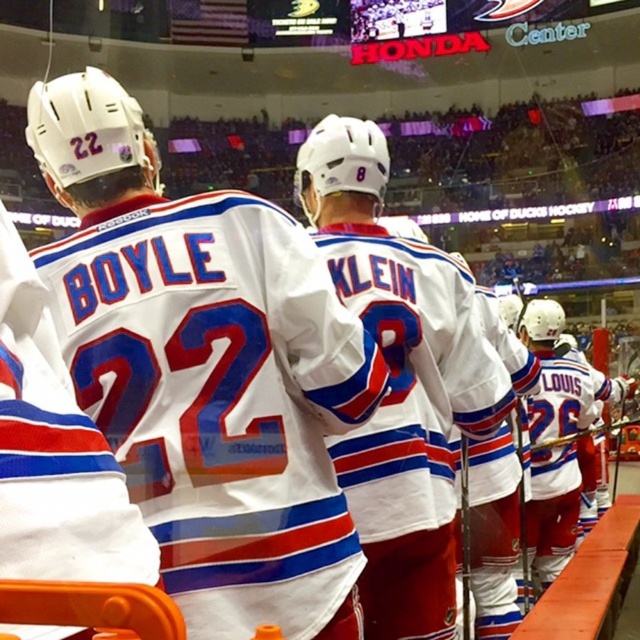
Question: Is white matte jersey at center smaller than white jersey at center?

Choices:
 (A) yes
 (B) no

Answer: (B)

Question: Which point is closer to the camera?

Choices:
 (A) white matte jersey at center
 (B) white jersey at center

Answer: (A)

Question: Which point is farther to the camera?

Choices:
 (A) (205, 385)
 (B) (420, 260)

Answer: (B)

Question: Is white matte jersey at center thinner than white jersey at center?

Choices:
 (A) no
 (B) yes

Answer: (A)

Question: Can you confirm if white matte jersey at center is positioned above white jersey at center?

Choices:
 (A) yes
 (B) no

Answer: (A)